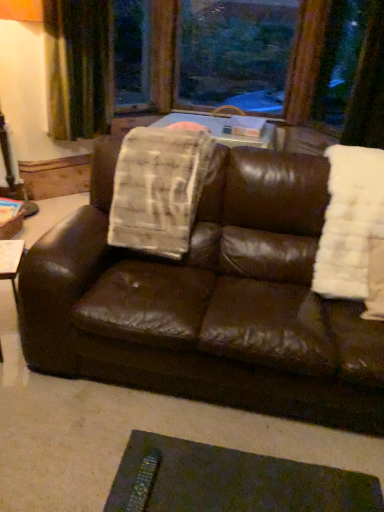
Question: In the image, is brown leather couch at center on the left side or the right side of metallic textured remote at lower center?

Choices:
 (A) left
 (B) right

Answer: (B)

Question: From the image's perspective, relative to metallic textured remote at lower center, is brown leather couch at center above or below?

Choices:
 (A) below
 (B) above

Answer: (B)

Question: Which of these objects is positioned farthest from the white fluffy blanket at right, marked as the first blanket in a right-to-left arrangement?

Choices:
 (A) green velvet curtain at upper left
 (B) transparent glass window at upper center, the second window screen viewed from the left
 (C) transparent glass window screen at upper center, arranged as the second window screen when viewed from the right
 (D) white textured blanket at center, the 2th blanket from the right
 (E) brown leather couch at center

Answer: (B)

Question: Which is farther from the brown leather couch at center?

Choices:
 (A) green velvet curtain at upper left
 (B) transparent glass window screen at upper center, arranged as the second window screen when viewed from the right
 (C) white fluffy blanket at right, marked as the first blanket in a right-to-left arrangement
 (D) white textured blanket at center, the 2th blanket from the right
 (E) transparent glass window at upper center, placed as the first window screen when sorted from right to left

Answer: (E)